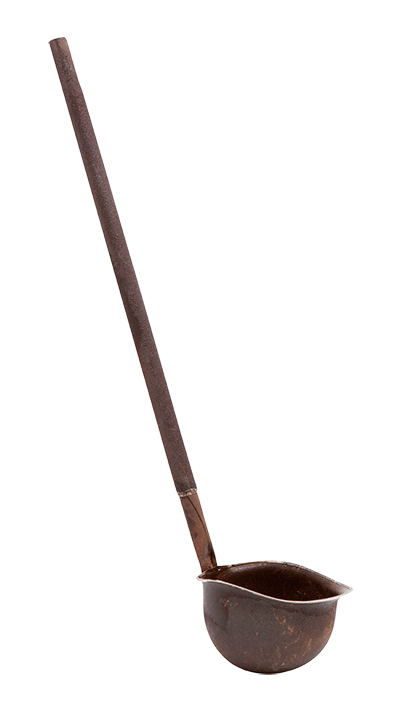
Where is `handle`? The width and height of the screenshot is (400, 712). handle is located at coordinates (150, 372).